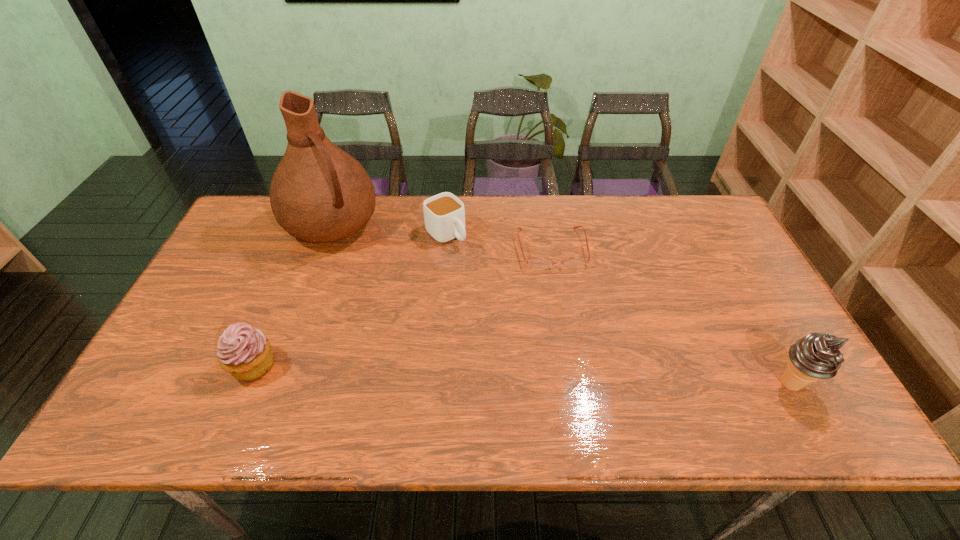
The width and height of the screenshot is (960, 540). Find the location of `the third tallest object`. the third tallest object is located at coordinates (245, 352).

Where is `the rightmost object`? the rightmost object is located at coordinates (816, 356).

Image resolution: width=960 pixels, height=540 pixels. What are the coordinates of `icecream` in the screenshot? It's located at (816, 356).

Find the location of a particular element. The width and height of the screenshot is (960, 540). the second object from right to left is located at coordinates (538, 263).

Locate an element on the screen. Image resolution: width=960 pixels, height=540 pixels. the shortest object is located at coordinates (538, 263).

Identify the location of the second shortest object. (444, 214).

Find the location of a particular element. cup is located at coordinates (444, 214).

At what (x,y) coordinates should I click in order to perform the action: click on pitcher. Please return your answer as a coordinate pair (x, y). This screenshot has width=960, height=540. Looking at the image, I should click on (319, 193).

You are a GUI agent. You are given a task and a screenshot of the screen. Output one action in this format:
    pyautogui.click(x=<x>, y=<y>)
    Task: Click on the vacant space positioned 0.160m on the right of the cupcake
    This screenshot has width=960, height=540.
    Given the screenshot: What is the action you would take?
    pyautogui.click(x=344, y=365)

In order to click on free spot located 0.120m on the left of the icecream in this screenshot , I will do `click(719, 384)`.